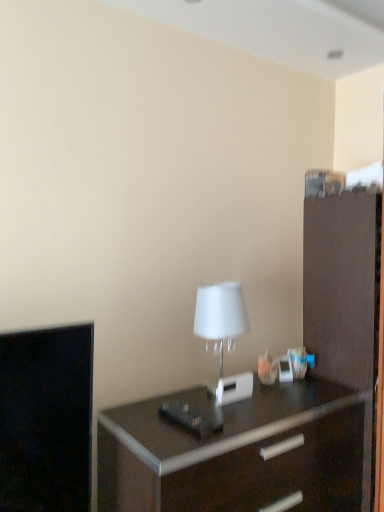
Where is `vacant space underneath white matte table lamp at center (from a real-world perspective)`? The image size is (384, 512). vacant space underneath white matte table lamp at center (from a real-world perspective) is located at coordinates (230, 401).